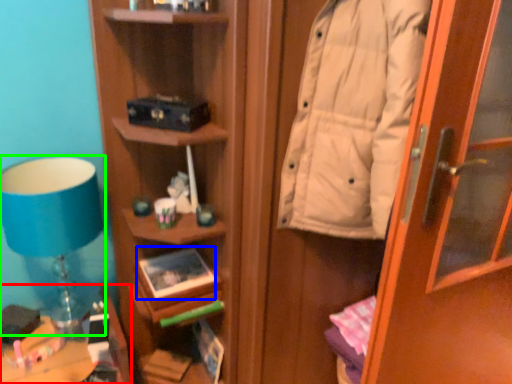
Question: Based on their relative distances, which object is farther from furniture (highlighted by a red box)? Choose from book (highlighted by a blue box) and table lamp (highlighted by a green box).

Choices:
 (A) book
 (B) table lamp

Answer: (B)